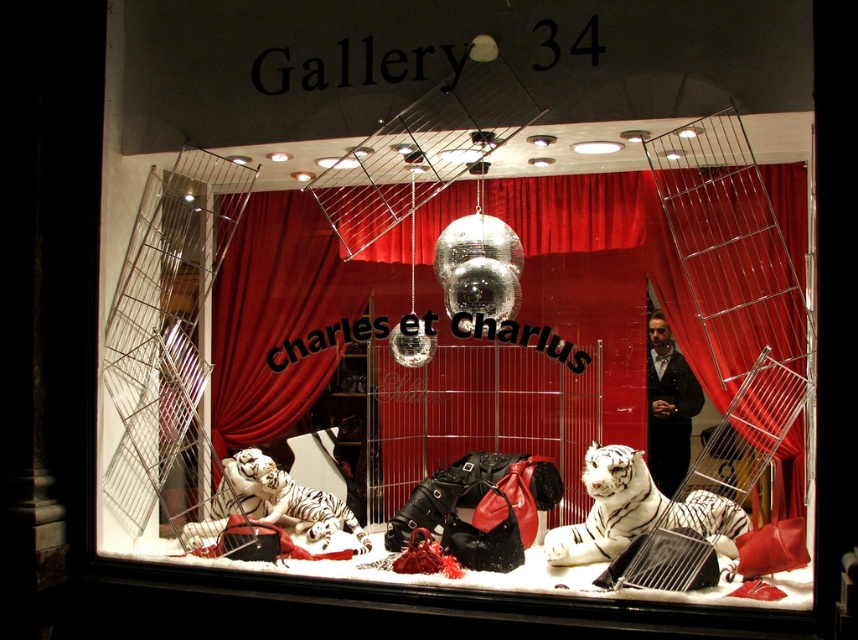
Question: Does white fur tiger at center come behind white ceramic tiger at lower left?

Choices:
 (A) yes
 (B) no

Answer: (B)

Question: Among these points, which one is farthest from the camera?

Choices:
 (A) (301, 524)
 (B) (639, 509)

Answer: (A)

Question: Observing the image, what is the correct spatial positioning of white fur tiger at center in reference to white ceramic tiger at lower left?

Choices:
 (A) below
 (B) above

Answer: (B)

Question: Which of the following is the farthest from the observer?

Choices:
 (A) (576, 524)
 (B) (239, 468)

Answer: (B)

Question: From the image, what is the correct spatial relationship of white fur tiger at center in relation to white ceramic tiger at lower left?

Choices:
 (A) left
 (B) right

Answer: (B)